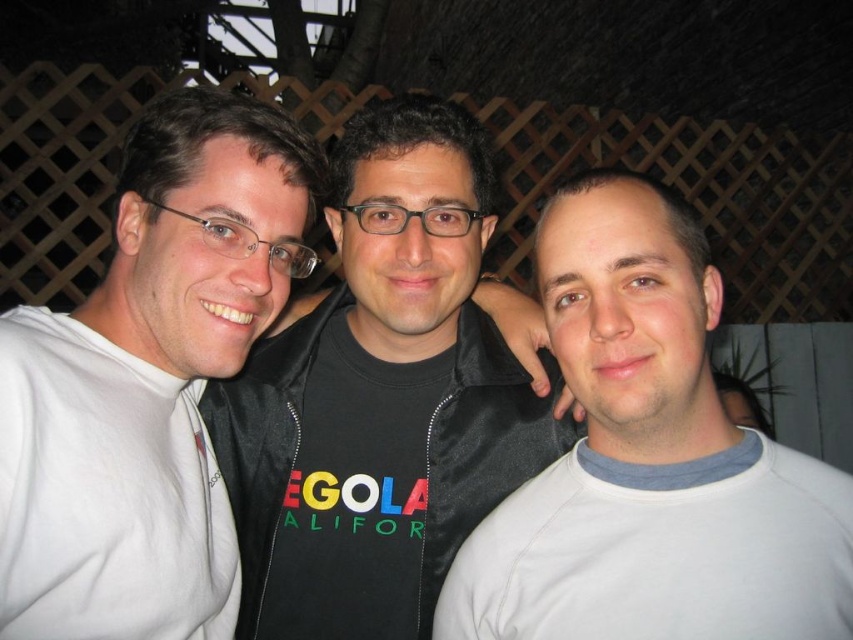
You are a photographer trying to adjust the lighting for a group photo. You notice two white shirts on the left side of the image. Which one is taller, the white matte shirt at left or the white cotton shirt at left?

The white matte shirt at left has a greater height compared to the white cotton shirt at left, so the white matte shirt at left is taller.